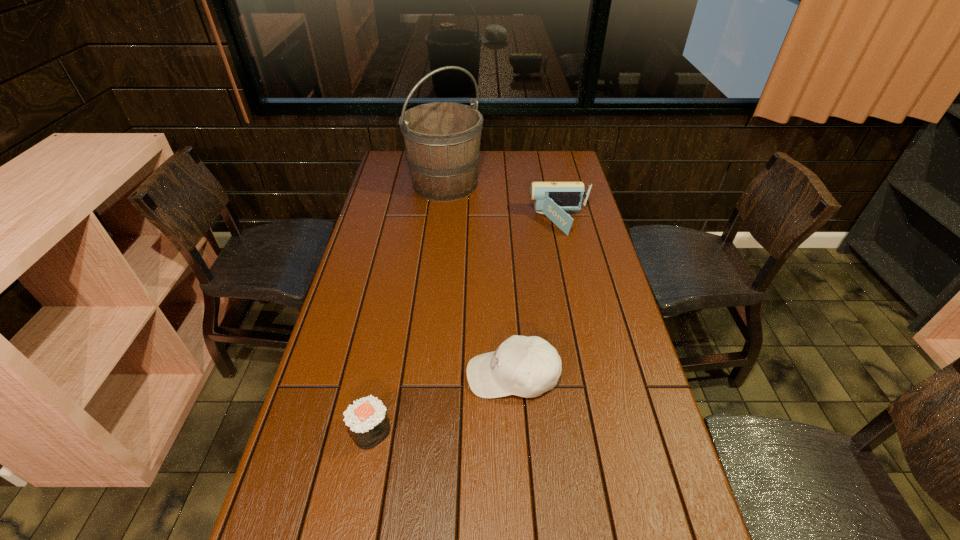
Where is `bucket`? bucket is located at coordinates (442, 139).

I want to click on the tallest object, so click(x=442, y=139).

Identify the location of the second farthest object. The height and width of the screenshot is (540, 960). (550, 198).

Identify the location of the second nearest object. The image size is (960, 540). (523, 366).

Locate an element on the screen. the shortest object is located at coordinates (366, 418).

You are a GUI agent. You are given a task and a screenshot of the screen. Output one action in this format:
    pyautogui.click(x=<x>, y=<y>)
    Task: Click on the sushi
    
    Given the screenshot: What is the action you would take?
    pyautogui.click(x=366, y=418)

Find the location of a particular element. The height and width of the screenshot is (540, 960). vacant area located on the front of the bucket is located at coordinates (436, 266).

The height and width of the screenshot is (540, 960). Identify the location of blank space located on the side of the second farthest object with the flip-out screen. (495, 222).

This screenshot has height=540, width=960. I want to click on vacant space positioned 0.390m on the side of the second farthest object with the flip-out screen, so click(x=420, y=222).

You are a GUI agent. You are given a task and a screenshot of the screen. Output one action in this format:
    pyautogui.click(x=<x>, y=<y>)
    Task: Click on the free region located on the side of the second farthest object with the flip-out screen
    
    Given the screenshot: What is the action you would take?
    pyautogui.click(x=457, y=222)